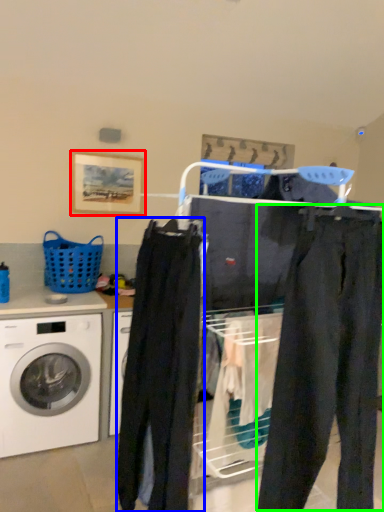
Question: Estimate the real-world distances between objects in this image. Which object is closer to picture frame (highlighted by a red box), clothing (highlighted by a blue box) or pants (highlighted by a green box)?

Choices:
 (A) clothing
 (B) pants

Answer: (A)